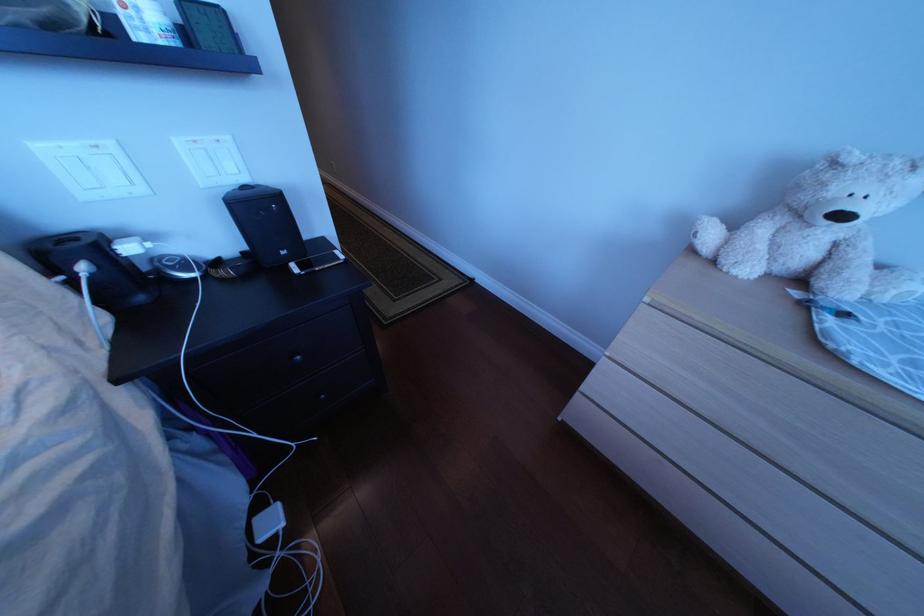
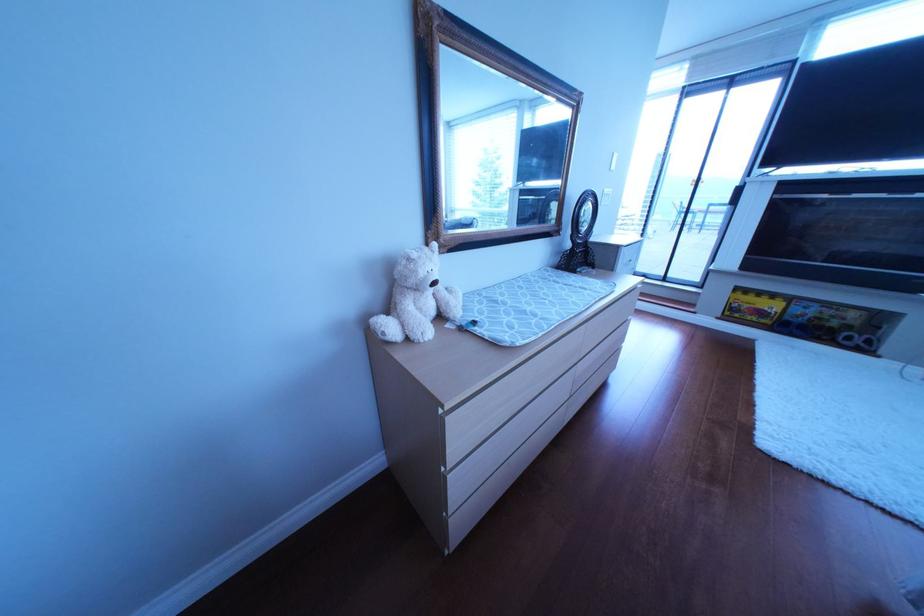
In the second image, find the point that corresponds to point 839,272 in the first image.

(458, 310)